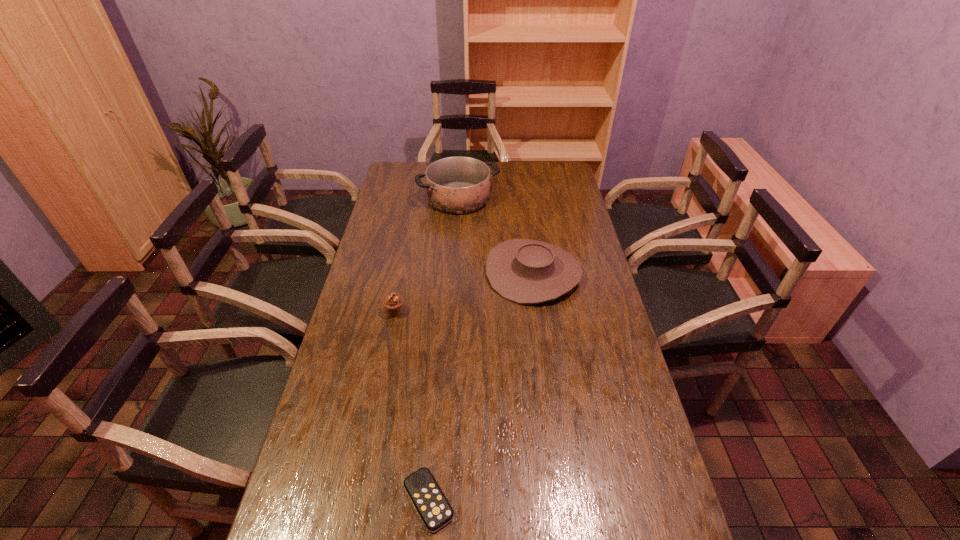
You are a GUI agent. You are given a task and a screenshot of the screen. Output one action in this format:
    pyautogui.click(x=<x>, y=<y>)
    Task: Click on the farthest object
    
    Given the screenshot: What is the action you would take?
    pyautogui.click(x=458, y=185)

The width and height of the screenshot is (960, 540). What are the coordinates of `saucepan` in the screenshot? It's located at pyautogui.click(x=458, y=185).

Locate an element on the screen. cowboy hat is located at coordinates (525, 271).

Image resolution: width=960 pixels, height=540 pixels. I want to click on muffin, so click(392, 303).

Identify the location of the shortest object. (431, 504).

The height and width of the screenshot is (540, 960). Find the location of `the nearest object`. the nearest object is located at coordinates (431, 504).

What are the coordinates of `vacant space located 0.110m on the right of the saucepan` in the screenshot? It's located at (524, 198).

Find the location of a particular element. free region located on the front of the cowboy hat is located at coordinates (540, 318).

Where is `free spot located 0.230m on the right of the muffin`? Image resolution: width=960 pixels, height=540 pixels. free spot located 0.230m on the right of the muffin is located at coordinates (472, 312).

Where is `free space located on the back of the remote control`? This screenshot has width=960, height=540. free space located on the back of the remote control is located at coordinates (435, 429).